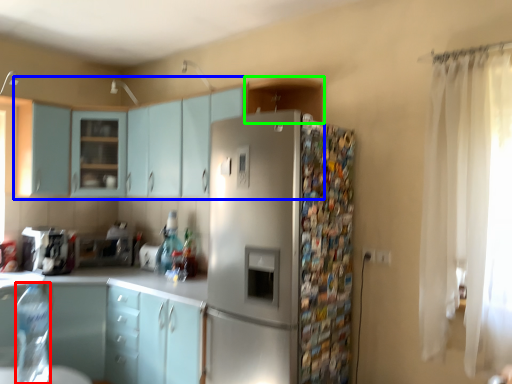
Question: Estimate the real-world distances between objects in this image. Which object is closer to bottle (highlighted by a red box), cabinetry (highlighted by a blue box) or cabinetry (highlighted by a green box)?

Choices:
 (A) cabinetry
 (B) cabinetry

Answer: (A)